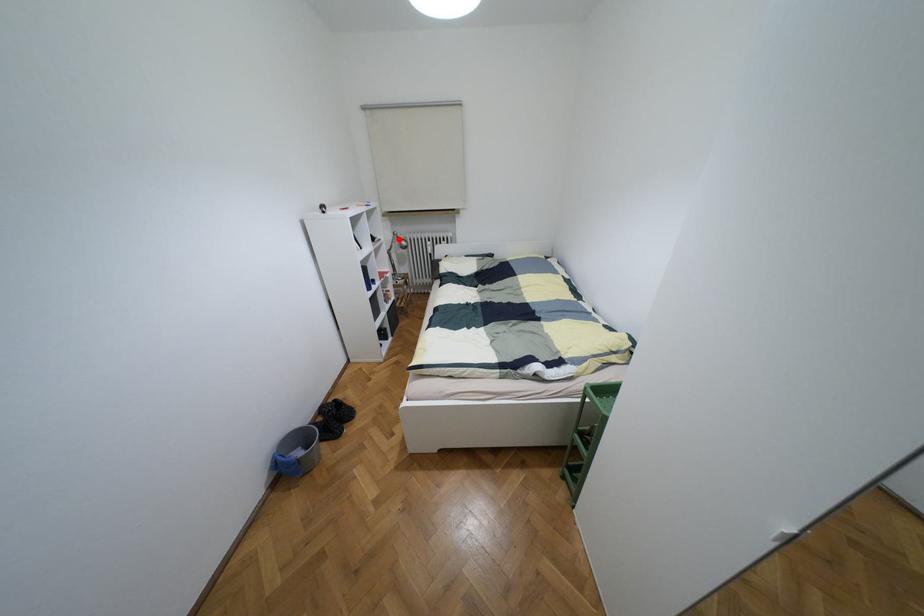
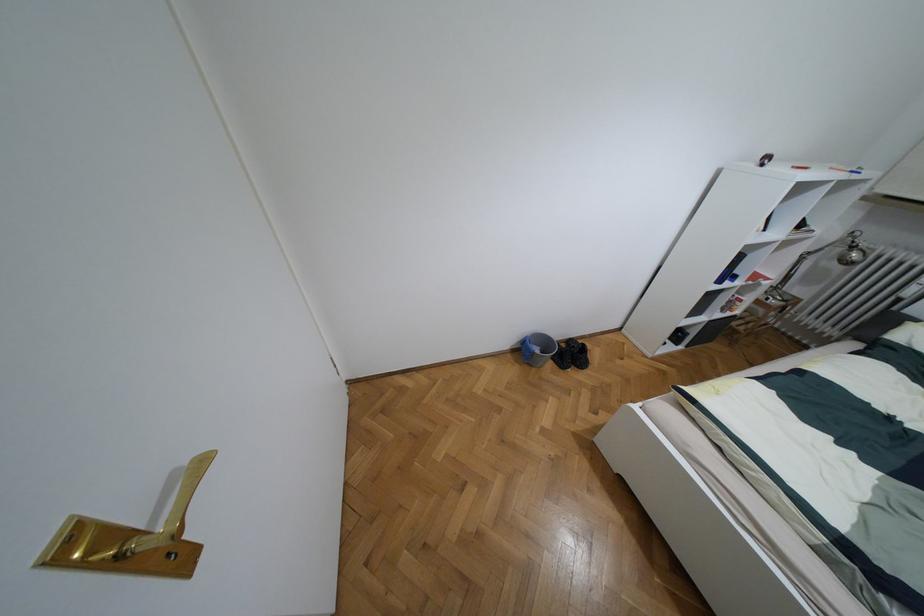
Find the pixel in the second image that matches the highlighted location in the first image.

(852, 246)